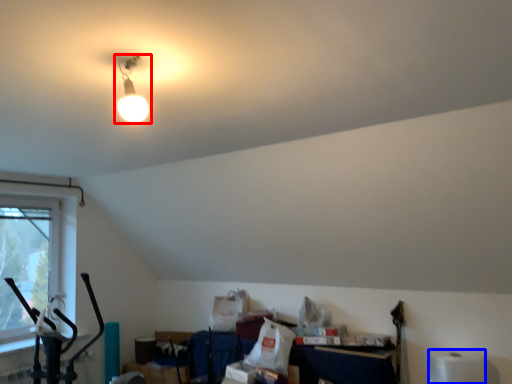
Question: Which point is further to the camera, lamp (highlighted by a red box) or toilet paper (highlighted by a blue box)?

Choices:
 (A) lamp
 (B) toilet paper

Answer: (B)